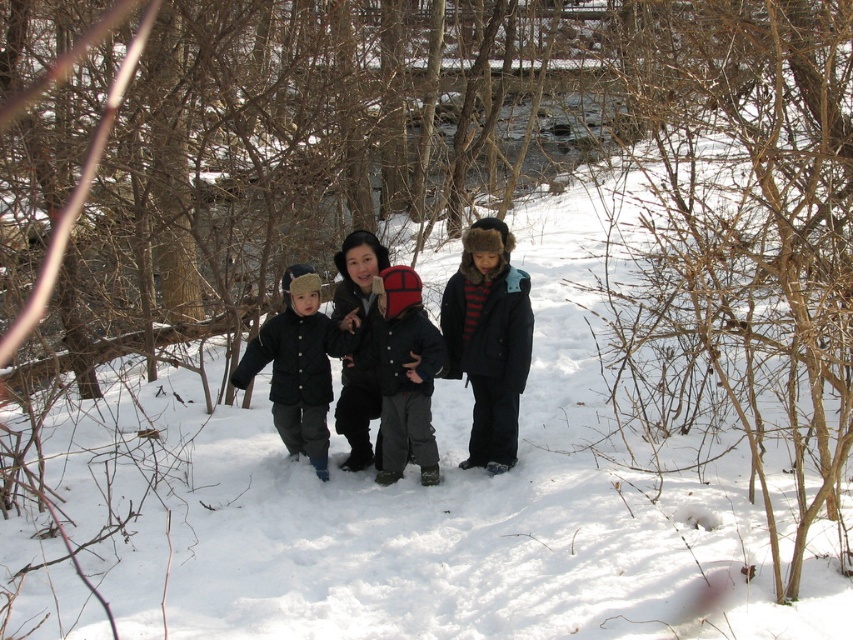
Which is more to the left, striped wool sweater at center or red knit hat at center?

Positioned to the left is red knit hat at center.

Can you confirm if striped wool sweater at center is positioned to the right of red knit hat at center?

Correct, you'll find striped wool sweater at center to the right of red knit hat at center.

Image resolution: width=853 pixels, height=640 pixels. What are the coordinates of `striped wool sweater at center` in the screenshot? It's located at (488, 339).

This screenshot has width=853, height=640. I want to click on striped wool sweater at center, so click(x=488, y=339).

Who is positioned more to the right, striped wool sweater at center or matte black coat at center?

striped wool sweater at center is more to the right.

Is point (462, 326) less distant than point (299, 371)?

No, it is behind (299, 371).

At what (x,y) coordinates should I click in order to perform the action: click on striped wool sweater at center. Please return your answer as a coordinate pair (x, y). The width and height of the screenshot is (853, 640). Looking at the image, I should click on (488, 339).

Can you confirm if matte black coat at center is positioned above red knit hat at center?

Correct, matte black coat at center is located above red knit hat at center.

Can you confirm if matte black coat at center is wider than red knit hat at center?

Correct, the width of matte black coat at center exceeds that of red knit hat at center.

Who is more forward, (253,353) or (409,410)?

Point (409,410) is in front.

You are a GUI agent. You are given a task and a screenshot of the screen. Output one action in this format:
    pyautogui.click(x=<x>, y=<y>)
    Task: Click on the matte black coat at center
    
    Given the screenshot: What is the action you would take?
    pyautogui.click(x=299, y=364)